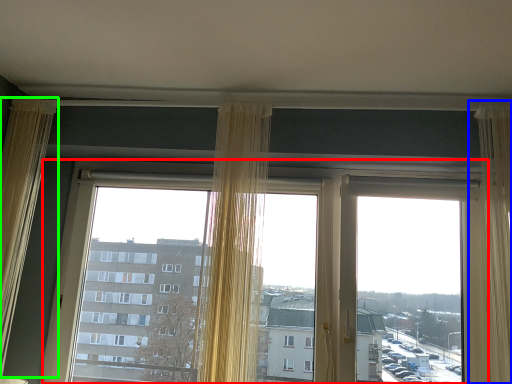
Question: Based on their relative distances, which object is farther from window (highlighted by a red box)? Choose from curtain (highlighted by a blue box) and curtain (highlighted by a green box).

Choices:
 (A) curtain
 (B) curtain

Answer: (A)